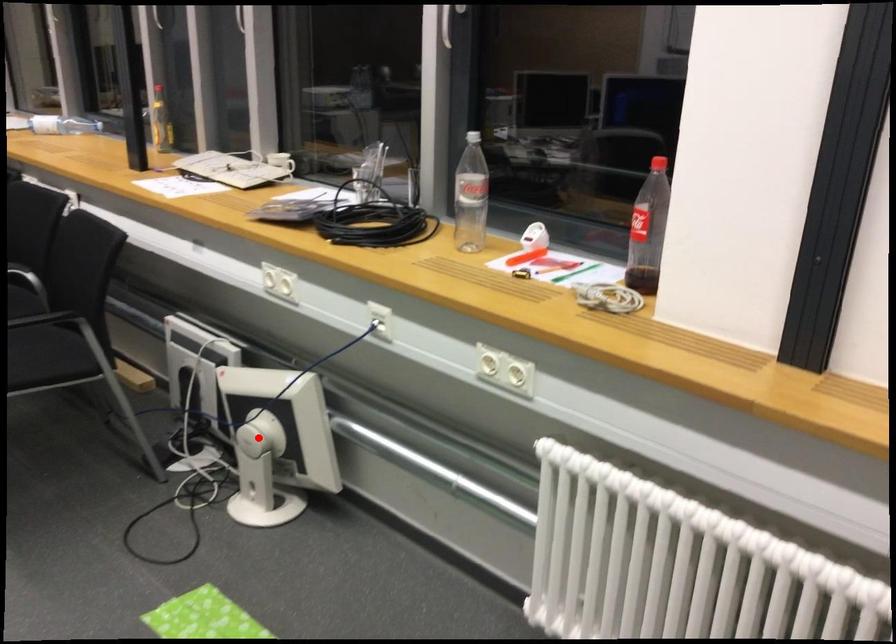
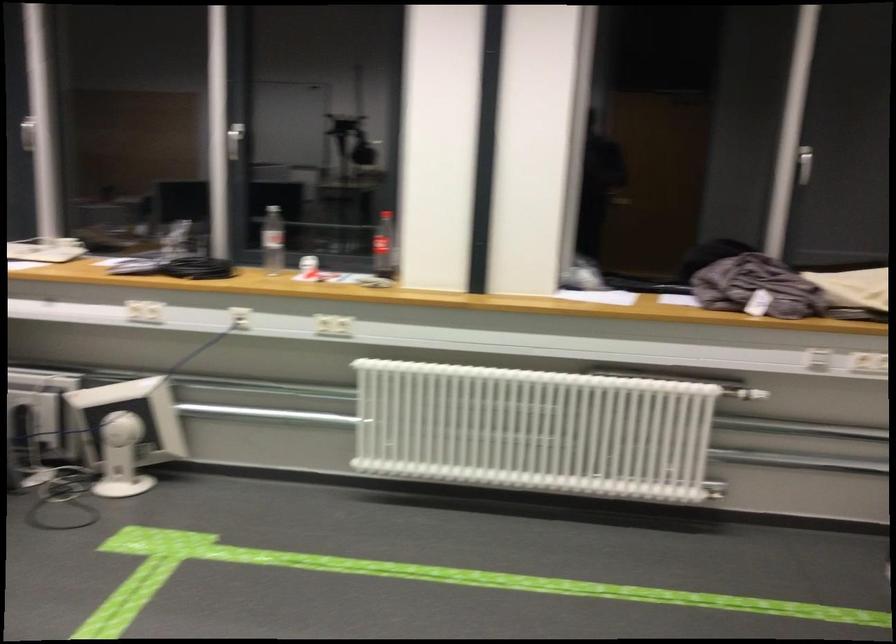
Question: I am providing you with two images of the same scene from different viewpoints. In image1, a red point is highlighted. Considering the same 3D point in image2, which of the following is correct?

Choices:
 (A) It is closer
 (B) It is farther

Answer: (B)